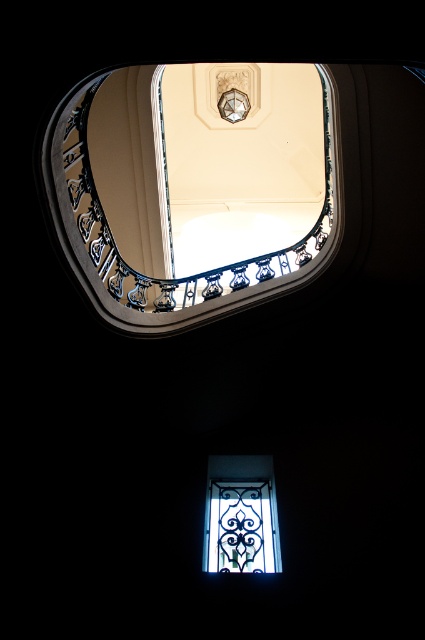
Does clear glass at upper center appear over clear glass window at lower center?

Correct, clear glass at upper center is located above clear glass window at lower center.

Which is behind, point (336, 96) or point (223, 483)?

Positioned behind is point (223, 483).

Between point (252, 291) and point (237, 476), which one is positioned behind?

Positioned behind is point (237, 476).

What are the coordinates of `clear glass at upper center` in the screenshot? It's located at (187, 280).